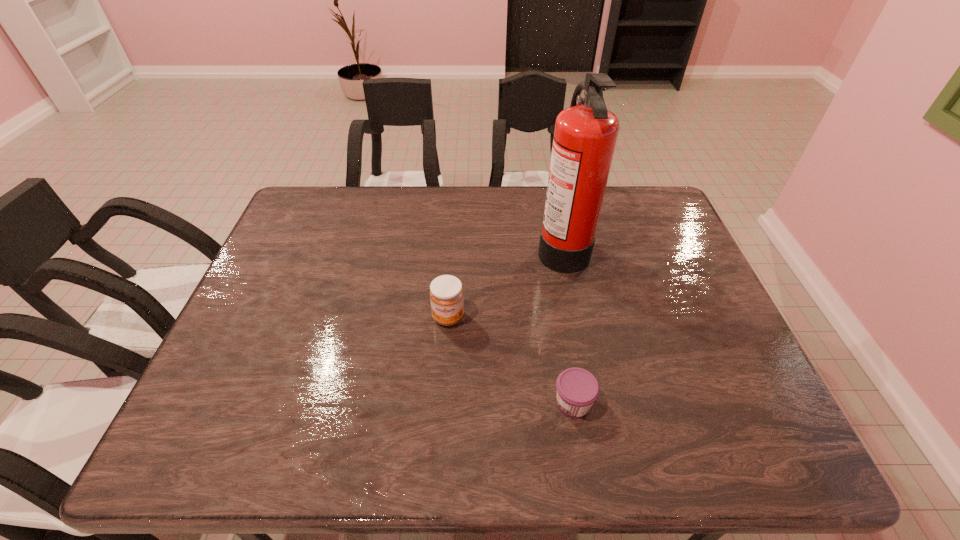
Where is `blank space at the near right corner of the desktop`? blank space at the near right corner of the desktop is located at coordinates (773, 459).

Identify the location of blank region between the shortest object and the tallest object. (567, 325).

This screenshot has width=960, height=540. In order to click on vacant space that's between the farther jam and the nearest object in this screenshot , I will do `click(511, 360)`.

Locate an element on the screen. This screenshot has height=540, width=960. free space between the tallest object and the leftmost object is located at coordinates (505, 282).

Locate an element on the screen. The width and height of the screenshot is (960, 540). unoccupied position between the right jam and the farthest object is located at coordinates (567, 325).

At what (x,y) coordinates should I click in order to perform the action: click on free space that is in between the shorter jam and the second farthest object. Please return your answer as a coordinate pair (x, y). The width and height of the screenshot is (960, 540). Looking at the image, I should click on (511, 360).

I want to click on free point between the right jam and the farthest object, so click(567, 325).

Identify the location of free point between the farthest object and the farther jam. The width and height of the screenshot is (960, 540). (505, 282).

Locate an element on the screen. The height and width of the screenshot is (540, 960). vacant point located between the tallest object and the nearest object is located at coordinates (567, 325).

The image size is (960, 540). I want to click on free space between the second nearest object and the shorter jam, so click(x=511, y=360).